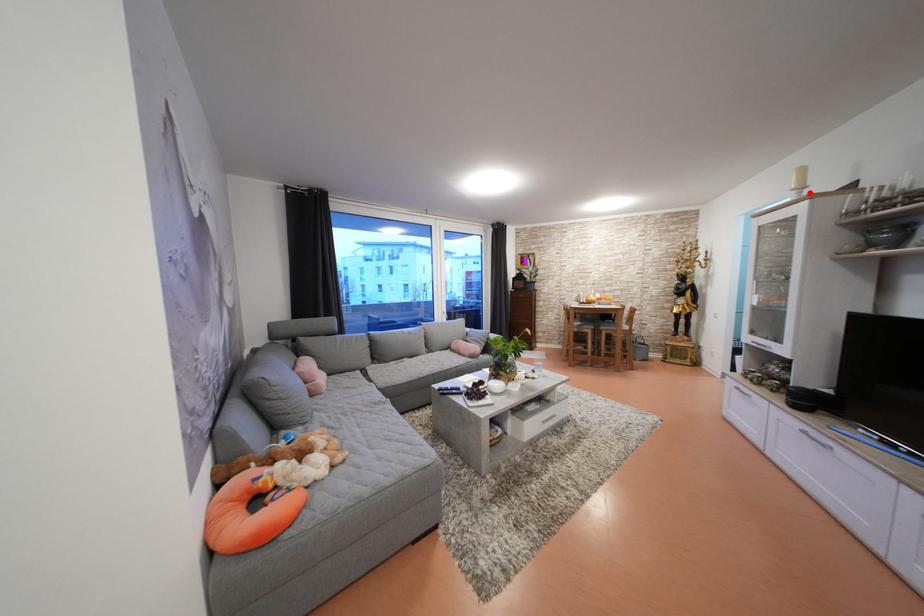
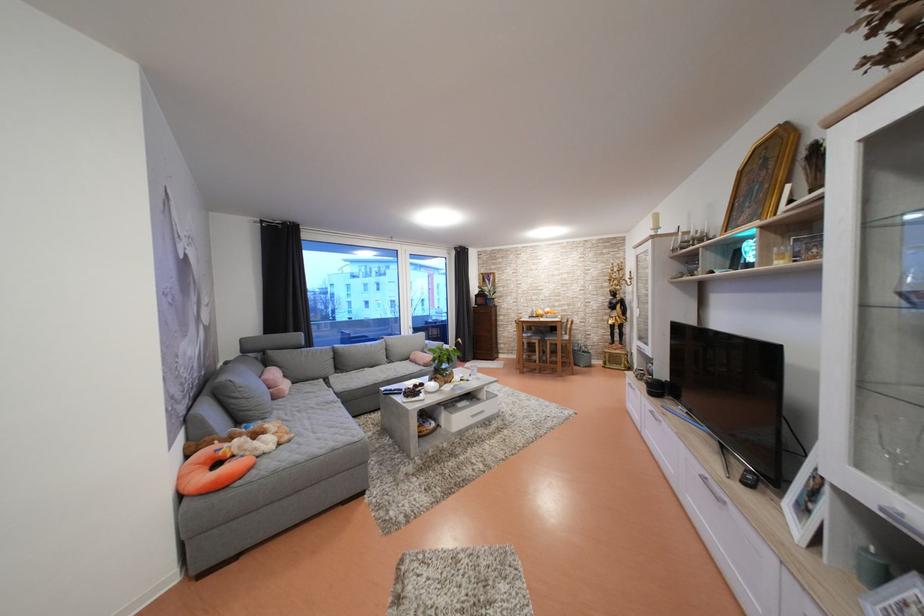
In the second image, find the point that corresponds to the highlighted location in the first image.

(664, 233)